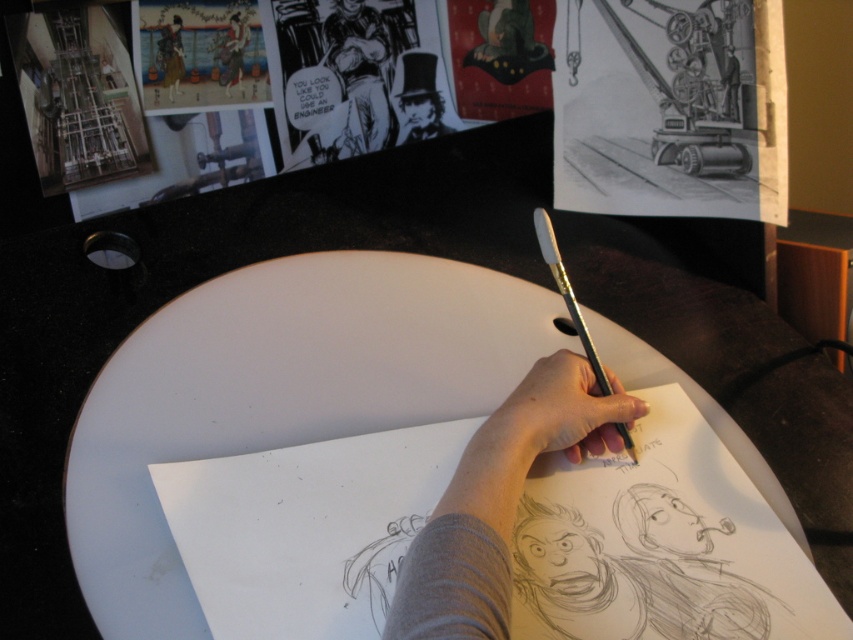
Does metallic silver pencil at center come in front of matte black kimono at upper left?

That is True.

What do you see at coordinates (567, 292) in the screenshot?
I see `metallic silver pencil at center` at bounding box center [567, 292].

Between point (564, 301) and point (235, 24), which one is positioned in front?

Point (564, 301) is in front.

I want to click on metallic silver pencil at center, so click(567, 292).

Can you confirm if smooth skin hand at center is smaller than silk kimono at upper left?

Actually, smooth skin hand at center might be larger than silk kimono at upper left.

Does smooth skin hand at center appear over silk kimono at upper left?

Incorrect, smooth skin hand at center is not positioned above silk kimono at upper left.

Is point (508, 458) closer to camera compared to point (181, 19)?

That is True.

Identify the location of smooth skin hand at center. (553, 417).

Can you confirm if metallic silver pencil at center is positioned above silk kimono at upper left?

Incorrect, metallic silver pencil at center is not positioned above silk kimono at upper left.

Can you confirm if metallic silver pencil at center is positioned below silk kimono at upper left?

Correct, metallic silver pencil at center is located below silk kimono at upper left.

Identify the location of metallic silver pencil at center. (567, 292).

Identify the location of metallic silver pencil at center. (567, 292).